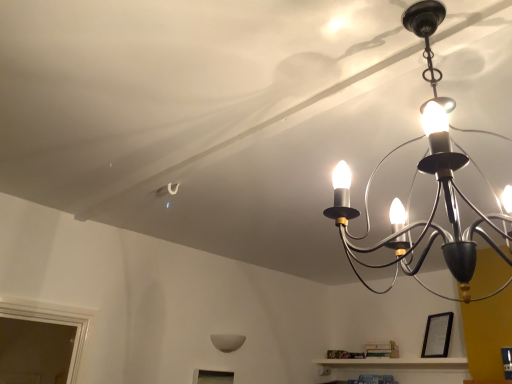
Where is `black matte picture frame at lower right`? black matte picture frame at lower right is located at coordinates (437, 335).

At what (x,y) coordinates should I click in order to perform the action: click on matte black chandelier at upper right, positioned as the second lamp in bottom-to-top order. Please return your answer as a coordinate pair (x, y). The width and height of the screenshot is (512, 384). Looking at the image, I should click on (426, 173).

Is matte black chandelier at upper right, which is the second lamp from back to front, next to black matte picture frame at lower right and touching it?

There is a gap between matte black chandelier at upper right, which is the second lamp from back to front, and black matte picture frame at lower right.

Considering the positions of point (402, 18) and point (441, 352), is point (402, 18) closer or farther from the camera than point (441, 352)?

Point (402, 18) is closer to the camera than point (441, 352).

Which of these two, matte black chandelier at upper right, which ranks as the 1th lamp in front-to-back order, or black matte picture frame at lower right, stands shorter?

black matte picture frame at lower right.

Considering the relative sizes of matte black chandelier at upper right, which ranks as the 1th lamp in front-to-back order, and black matte picture frame at lower right in the image provided, is matte black chandelier at upper right, which ranks as the 1th lamp in front-to-back order, thinner than black matte picture frame at lower right?

No.

Based on the photo, between white matte wall sconce at lower center, which is the first lamp in left-to-right order, and black matte picture frame at lower right, which one has larger size?

Bigger between the two is black matte picture frame at lower right.

Where is `picture frame above the white matte wall sconce at lower center, which appears as the 2th lamp when viewed from the right (from the image's perspective)`? picture frame above the white matte wall sconce at lower center, which appears as the 2th lamp when viewed from the right (from the image's perspective) is located at coordinates (437, 335).

From the picture: Does white matte wall sconce at lower center, which is counted as the 1th lamp, starting from the back, touch black matte picture frame at lower right?

No.

In terms of size, does matte black chandelier at upper right, which is the second lamp from back to front, appear bigger or smaller than white matte wall sconce at lower center, marked as the second lamp in a top-to-bottom arrangement?

Considering their sizes, matte black chandelier at upper right, which is the second lamp from back to front, takes up more space than white matte wall sconce at lower center, marked as the second lamp in a top-to-bottom arrangement.

From a real-world perspective, is matte black chandelier at upper right, which ranks as the 1th lamp in front-to-back order, on top of white matte wall sconce at lower center, arranged as the first lamp when ordered from the bottom?

Yes, from a real-world perspective, matte black chandelier at upper right, which ranks as the 1th lamp in front-to-back order, is over white matte wall sconce at lower center, arranged as the first lamp when ordered from the bottom

You are a GUI agent. You are given a task and a screenshot of the screen. Output one action in this format:
    pyautogui.click(x=<x>, y=<y>)
    Task: Click on the lamp behind the matte black chandelier at upper right, which ranks as the first lamp in right-to-left order
    
    Given the screenshot: What is the action you would take?
    pyautogui.click(x=227, y=342)

Considering the relative sizes of matte black chandelier at upper right, which ranks as the first lamp in right-to-left order, and white matte wall sconce at lower center, which appears as the 2th lamp when viewed from the right, in the image provided, is matte black chandelier at upper right, which ranks as the first lamp in right-to-left order, shorter than white matte wall sconce at lower center, which appears as the 2th lamp when viewed from the right,?

In fact, matte black chandelier at upper right, which ranks as the first lamp in right-to-left order, may be taller than white matte wall sconce at lower center, which appears as the 2th lamp when viewed from the right.

Between point (428, 333) and point (234, 347), which one is positioned behind?

Point (428, 333)

Between black matte picture frame at lower right and white matte wall sconce at lower center, which is counted as the 1th lamp, starting from the back, which one has larger size?

black matte picture frame at lower right is bigger.

Where is `lamp that appears below the black matte picture frame at lower right (from the image's perspective)`? This screenshot has height=384, width=512. lamp that appears below the black matte picture frame at lower right (from the image's perspective) is located at coordinates (227, 342).

From a real-world perspective, does black matte picture frame at lower right sit lower than white matte wall sconce at lower center, which is the second lamp from front to back?

No, from a real-world perspective, black matte picture frame at lower right is not below white matte wall sconce at lower center, which is the second lamp from front to back.

From a real-world perspective, relative to matte black chandelier at upper right, the 2th lamp when ordered from left to right, is black matte picture frame at lower right vertically above or below?

From a real-world perspective, black matte picture frame at lower right is physically below matte black chandelier at upper right, the 2th lamp when ordered from left to right.

Which is further, [434,349] or [343,226]?

The point [434,349] is farther.

Is black matte picture frame at lower right not close to matte black chandelier at upper right, which ranks as the first lamp in right-to-left order?

black matte picture frame at lower right is positioned a significant distance from matte black chandelier at upper right, which ranks as the first lamp in right-to-left order.

Based on their sizes in the image, would you say black matte picture frame at lower right is bigger or smaller than matte black chandelier at upper right, which is the second lamp from back to front?

Clearly, black matte picture frame at lower right is smaller in size than matte black chandelier at upper right, which is the second lamp from back to front.

From a real-world perspective, is white matte wall sconce at lower center, marked as the second lamp in a top-to-bottom arrangement, positioned above or below matte black chandelier at upper right, which ranks as the 1th lamp in front-to-back order?

In terms of real-world spatial position, white matte wall sconce at lower center, marked as the second lamp in a top-to-bottom arrangement, is below matte black chandelier at upper right, which ranks as the 1th lamp in front-to-back order.

Is point (210, 335) farther from camera compared to point (400, 245)?

Yes, point (210, 335) is farther from viewer.

From the picture: Considering the relative sizes of white matte wall sconce at lower center, arranged as the first lamp when ordered from the bottom, and matte black chandelier at upper right, the 2th lamp when ordered from left to right, in the image provided, is white matte wall sconce at lower center, arranged as the first lamp when ordered from the bottom, taller than matte black chandelier at upper right, the 2th lamp when ordered from left to right,?

No, white matte wall sconce at lower center, arranged as the first lamp when ordered from the bottom, is not taller than matte black chandelier at upper right, the 2th lamp when ordered from left to right.

Does white matte wall sconce at lower center, marked as the second lamp in a top-to-bottom arrangement, appear on the right side of matte black chandelier at upper right, marked as the 1th lamp in a top-to-bottom arrangement?

In fact, white matte wall sconce at lower center, marked as the second lamp in a top-to-bottom arrangement, is to the left of matte black chandelier at upper right, marked as the 1th lamp in a top-to-bottom arrangement.

This screenshot has height=384, width=512. I want to click on picture frame below the matte black chandelier at upper right, marked as the 1th lamp in a top-to-bottom arrangement (from the image's perspective), so click(x=437, y=335).

What are the coordinates of `picture frame above the white matte wall sconce at lower center, marked as the second lamp in a top-to-bottom arrangement (from a real-world perspective)` in the screenshot? It's located at (437, 335).

From the picture: When comparing their distances from matte black chandelier at upper right, which is the second lamp from back to front, does white matte wall sconce at lower center, which is counted as the 1th lamp, starting from the back, or black matte picture frame at lower right seem further?

white matte wall sconce at lower center, which is counted as the 1th lamp, starting from the back, lies further to matte black chandelier at upper right, which is the second lamp from back to front, than the other object.

Based on their spatial positions, is black matte picture frame at lower right or matte black chandelier at upper right, which is the second lamp from back to front, further from white matte wall sconce at lower center, marked as the second lamp in a top-to-bottom arrangement?

The object further to white matte wall sconce at lower center, marked as the second lamp in a top-to-bottom arrangement, is matte black chandelier at upper right, which is the second lamp from back to front.

Looking at the image, which one is located further to white matte wall sconce at lower center, marked as the second lamp in a top-to-bottom arrangement, matte black chandelier at upper right, which ranks as the 1th lamp in front-to-back order, or black matte picture frame at lower right?

matte black chandelier at upper right, which ranks as the 1th lamp in front-to-back order, is positioned further to the anchor white matte wall sconce at lower center, marked as the second lamp in a top-to-bottom arrangement.

Which object lies nearer to the anchor point black matte picture frame at lower right, matte black chandelier at upper right, positioned as the second lamp in bottom-to-top order, or white matte wall sconce at lower center, which is the first lamp in left-to-right order?

The object closer to black matte picture frame at lower right is white matte wall sconce at lower center, which is the first lamp in left-to-right order.

Which object lies nearer to the anchor point matte black chandelier at upper right, which ranks as the first lamp in right-to-left order, black matte picture frame at lower right or white matte wall sconce at lower center, which is counted as the 1th lamp, starting from the back?

Based on the image, black matte picture frame at lower right appears to be nearer to matte black chandelier at upper right, which ranks as the first lamp in right-to-left order.

Estimate the real-world distances between objects in this image. Which object is closer to black matte picture frame at lower right, white matte wall sconce at lower center, which is counted as the 1th lamp, starting from the back, or matte black chandelier at upper right, marked as the 1th lamp in a top-to-bottom arrangement?

Based on the image, white matte wall sconce at lower center, which is counted as the 1th lamp, starting from the back, appears to be nearer to black matte picture frame at lower right.

What are the coordinates of `picture frame located between matte black chandelier at upper right, marked as the 1th lamp in a top-to-bottom arrangement, and white matte wall sconce at lower center, which is the first lamp in left-to-right order, in the depth direction` in the screenshot? It's located at (437, 335).